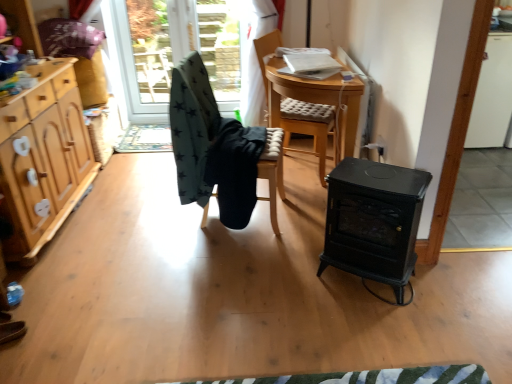
Find the location of `green star-patterned fabric at upper left, the 1th window screen viewed from the right`. green star-patterned fabric at upper left, the 1th window screen viewed from the right is located at coordinates (173, 51).

This screenshot has width=512, height=384. Identify the location of black cast iron stove at center. (374, 221).

You are a GUI agent. You are given a task and a screenshot of the screen. Output one action in this format:
    pyautogui.click(x=<x>, y=<y>)
    Task: Click on the wooden cabinet at left
    The width and height of the screenshot is (512, 384).
    Given the screenshot: What is the action you would take?
    pyautogui.click(x=42, y=159)

In order to click on black fabric chair at center, the 2th chair positioned from the left in this screenshot , I will do `click(273, 172)`.

What do you see at coordinates (151, 48) in the screenshot? I see `transparent glass door at upper center, the 2th window screen in the right-to-left sequence` at bounding box center [151, 48].

How much space does transparent glass door at upper center, the 2th window screen in the right-to-left sequence, occupy horizontally?

transparent glass door at upper center, the 2th window screen in the right-to-left sequence, is 11.15 centimeters wide.

At what (x,y) coordinates should I click in order to perform the action: click on green star-patterned fabric at upper left, the 1th window screen viewed from the right. Please return your answer as a coordinate pair (x, y). Image resolution: width=512 pixels, height=384 pixels. Looking at the image, I should click on (173, 51).

Considering the sizes of wooden cabinet at left and black cast iron stove at center in the image, is wooden cabinet at left taller or shorter than black cast iron stove at center?

wooden cabinet at left is taller than black cast iron stove at center.

Does point (63, 138) lie in front of point (334, 222)?

No, (63, 138) is behind (334, 222).

Where is `table behind the wooden cabinet at left`? The height and width of the screenshot is (384, 512). table behind the wooden cabinet at left is located at coordinates (374, 221).

From the image's perspective, would you say wooden cabinet at left is shown under green star-patterned fabric at upper left, which is the 2th window screen from left to right?

Yes, from the image's perspective, wooden cabinet at left is beneath green star-patterned fabric at upper left, which is the 2th window screen from left to right.

Considering the sizes of objects wooden cabinet at left and green star-patterned fabric at upper left, the 1th window screen viewed from the right, in the image provided, who is smaller, wooden cabinet at left or green star-patterned fabric at upper left, the 1th window screen viewed from the right,?

With smaller size is green star-patterned fabric at upper left, the 1th window screen viewed from the right.

From a real-world perspective, does wooden cabinet at left sit lower than green star-patterned fabric at upper left, which is the 2th window screen from left to right?

No.

Is wooden cabinet at left beside green star-patterned fabric at upper left, which is the 2th window screen from left to right?

wooden cabinet at left is not next to green star-patterned fabric at upper left, which is the 2th window screen from left to right, and they're not touching.

Relative to black fabric chair at center, the 2th chair positioned from the left, is transparent glass door at upper center, the 2th window screen in the right-to-left sequence, in front or behind?

Clearly, transparent glass door at upper center, the 2th window screen in the right-to-left sequence, is behind black fabric chair at center, the 2th chair positioned from the left.

From the image's perspective, is transparent glass door at upper center, the 2th window screen in the right-to-left sequence, above or below black fabric chair at center, marked as the 2th chair in a right-to-left arrangement?

transparent glass door at upper center, the 2th window screen in the right-to-left sequence, is situated higher than black fabric chair at center, marked as the 2th chair in a right-to-left arrangement, in the image.

Locate an element on the screen. The height and width of the screenshot is (384, 512). the 2nd window screen counting from the left side of the black fabric chair at center, the 2th chair positioned from the left is located at coordinates (151, 48).

From the image's perspective, is transparent glass door at upper center, the 2th window screen in the right-to-left sequence, above or below green star-patterned fabric at upper left, the 1th window screen viewed from the right?

From the image's perspective, transparent glass door at upper center, the 2th window screen in the right-to-left sequence, appears above green star-patterned fabric at upper left, the 1th window screen viewed from the right.

Considering the relative sizes of transparent glass door at upper center, the 2th window screen in the right-to-left sequence, and green star-patterned fabric at upper left, which is the 2th window screen from left to right, in the image provided, is transparent glass door at upper center, the 2th window screen in the right-to-left sequence, thinner than green star-patterned fabric at upper left, which is the 2th window screen from left to right,?

In fact, transparent glass door at upper center, the 2th window screen in the right-to-left sequence, might be wider than green star-patterned fabric at upper left, which is the 2th window screen from left to right.

Is transparent glass door at upper center, the 2th window screen in the right-to-left sequence, looking in the opposite direction of green star-patterned fabric at upper left, which is the 2th window screen from left to right?

Yes, green star-patterned fabric at upper left, which is the 2th window screen from left to right, is at the back of transparent glass door at upper center, the 2th window screen in the right-to-left sequence.

From a real-world perspective, relative to green star-patterned fabric at upper left, which is the 2th window screen from left to right, is transparent glass door at upper center, the 2th window screen in the right-to-left sequence, vertically above or below?

In terms of real-world spatial position, transparent glass door at upper center, the 2th window screen in the right-to-left sequence, is above green star-patterned fabric at upper left, which is the 2th window screen from left to right.

From the image's perspective, is green star-patterned fabric at upper left, which is the 2th window screen from left to right, under black fabric chair at center, marked as the 2th chair in a right-to-left arrangement?

Actually, green star-patterned fabric at upper left, which is the 2th window screen from left to right, appears above black fabric chair at center, marked as the 2th chair in a right-to-left arrangement, in the image.

Who is taller, green star-patterned fabric at upper left, which is the 2th window screen from left to right, or black fabric chair at center, the 2th chair positioned from the left?

With more height is green star-patterned fabric at upper left, which is the 2th window screen from left to right.

Which is more to the left, green star-patterned fabric at upper left, which is the 2th window screen from left to right, or black fabric chair at center, marked as the 2th chair in a right-to-left arrangement?

From the viewer's perspective, green star-patterned fabric at upper left, which is the 2th window screen from left to right, appears more on the left side.

Does green star-patterned fabric at upper left, which is the 2th window screen from left to right, have a greater width compared to black fabric chair at center, marked as the 2th chair in a right-to-left arrangement?

In fact, green star-patterned fabric at upper left, which is the 2th window screen from left to right, might be narrower than black fabric chair at center, marked as the 2th chair in a right-to-left arrangement.

Which object is further away from the camera, green star-patterned fabric at upper left, which is the 2th window screen from left to right, or transparent glass door at upper center, the 2th window screen in the right-to-left sequence?

transparent glass door at upper center, the 2th window screen in the right-to-left sequence, is further away from the camera.

Is green star-patterned fabric at upper left, the 1th window screen viewed from the right, oriented away from transparent glass door at upper center, marked as the first window screen in a left-to-right arrangement?

Yes, transparent glass door at upper center, marked as the first window screen in a left-to-right arrangement, is at the back of green star-patterned fabric at upper left, the 1th window screen viewed from the right.

Considering the points (124, 22) and (137, 36), which point is behind, point (124, 22) or point (137, 36)?

The point (137, 36) is behind.

Is green star-patterned fabric at upper left, which is the 2th window screen from left to right, not near transparent glass door at upper center, the 2th window screen in the right-to-left sequence?

No, green star-patterned fabric at upper left, which is the 2th window screen from left to right, is not far away from transparent glass door at upper center, the 2th window screen in the right-to-left sequence.

From the image's perspective, starting from the wooden cabinet at left, which chair is the 2nd one below? Please provide its 2D coordinates.

[(273, 172)]

In the scene shown: Which point is more forward, (282, 166) or (40, 96)?

The point (40, 96) is closer to the camera.

Which of these two, black fabric chair at center, marked as the 2th chair in a right-to-left arrangement, or wooden cabinet at left, is wider?

Wider between the two is wooden cabinet at left.

Between black fabric chair at center, the 2th chair positioned from the left, and wooden cabinet at left, which one has larger size?

wooden cabinet at left is bigger.

At what (x,y) coordinates should I click in order to perform the action: click on cabinetry above the black cast iron stove at center (from a real-world perspective). Please return your answer as a coordinate pair (x, y). Looking at the image, I should click on (42, 159).

This screenshot has height=384, width=512. I want to click on the 2nd window screen located beneath the wooden cabinet at left (from a real-world perspective), so click(x=173, y=51).

Considering their positions, is dark green fabric chair at center, which is the 1th chair from left to right, positioned closer to wooden chair with cushion at center, marked as the 1th chair in a right-to-left arrangement, than green star-patterned fabric at upper left, which is the 2th window screen from left to right?

Based on the image, dark green fabric chair at center, which is the 1th chair from left to right, appears to be nearer to wooden chair with cushion at center, marked as the 1th chair in a right-to-left arrangement.

Estimate the real-world distances between objects in this image. Which object is further from dark green fabric chair at center, which is the 1th chair from left to right, wooden cabinet at left or green star-patterned fabric at upper left, the 1th window screen viewed from the right?

green star-patterned fabric at upper left, the 1th window screen viewed from the right.

From the picture: From the image, which object appears to be nearer to dark green fabric chair at center, which is the 1th chair from left to right, wooden cabinet at left or black cast iron stove at center?

black cast iron stove at center is positioned closer to the anchor dark green fabric chair at center, which is the 1th chair from left to right.

Estimate the real-world distances between objects in this image. Which object is further from wooden cabinet at left, black cast iron stove at center or transparent glass door at upper center, the 2th window screen in the right-to-left sequence?

Among the two, black cast iron stove at center is located further to wooden cabinet at left.

Looking at the image, which one is located further to wooden cabinet at left, black fabric chair at center, marked as the 2th chair in a right-to-left arrangement, or dark green fabric chair at center, which is the 1th chair from left to right?

black fabric chair at center, marked as the 2th chair in a right-to-left arrangement, is further to wooden cabinet at left.

Considering their positions, is transparent glass door at upper center, the 2th window screen in the right-to-left sequence, positioned closer to green star-patterned fabric at upper left, the 1th window screen viewed from the right, than dark green fabric chair at center, which is the 1th chair from left to right?

transparent glass door at upper center, the 2th window screen in the right-to-left sequence.

Looking at this image, from the image, which object appears to be farther from wooden chair with cushion at center, the 3th chair positioned from the left, black fabric chair at center, marked as the 2th chair in a right-to-left arrangement, or green star-patterned fabric at upper left, which is the 2th window screen from left to right?

green star-patterned fabric at upper left, which is the 2th window screen from left to right, is positioned further to the anchor wooden chair with cushion at center, the 3th chair positioned from the left.

When comparing their distances from wooden cabinet at left, does black fabric chair at center, the 2th chair positioned from the left, or transparent glass door at upper center, the 2th window screen in the right-to-left sequence, seem closer?

black fabric chair at center, the 2th chair positioned from the left, is positioned closer to the anchor wooden cabinet at left.

Identify the location of window screen positioned between black fabric chair at center, marked as the 2th chair in a right-to-left arrangement, and transparent glass door at upper center, the 2th window screen in the right-to-left sequence, from near to far. (173, 51).

Identify the location of chair between dark green fabric chair at center, which is the 1th chair from left to right, and wooden chair with cushion at center, marked as the 1th chair in a right-to-left arrangement, along the z-axis. (273, 172).

The image size is (512, 384). I want to click on chair between wooden cabinet at left and black fabric chair at center, the 2th chair positioned from the left, so click(219, 150).

In order to click on chair between black fabric chair at center, the 2th chair positioned from the left, and transparent glass door at upper center, marked as the first window screen in a left-to-right arrangement, in the front-back direction in this screenshot , I will do `click(310, 127)`.